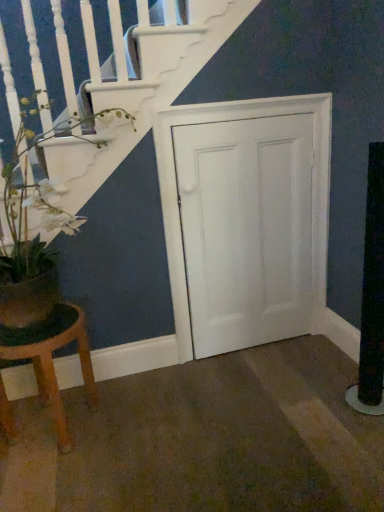
The image size is (384, 512). In order to click on free space between wooden stool at lower left and white wood door at center in this screenshot , I will do `click(178, 385)`.